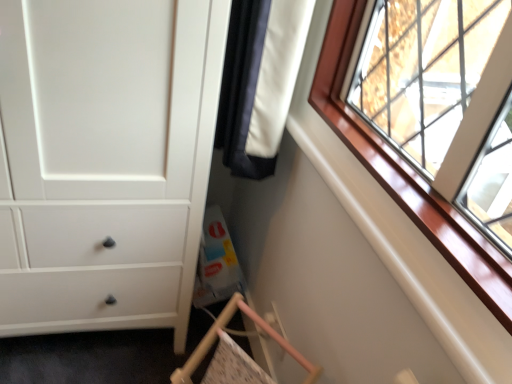
Identify the location of wooden fabric folding chair at lower left. This screenshot has width=512, height=384. (236, 353).

Describe the element at coordinates (236, 353) in the screenshot. I see `wooden fabric folding chair at lower left` at that location.

The width and height of the screenshot is (512, 384). Find the location of `wooden fabric folding chair at lower left`. wooden fabric folding chair at lower left is located at coordinates 236,353.